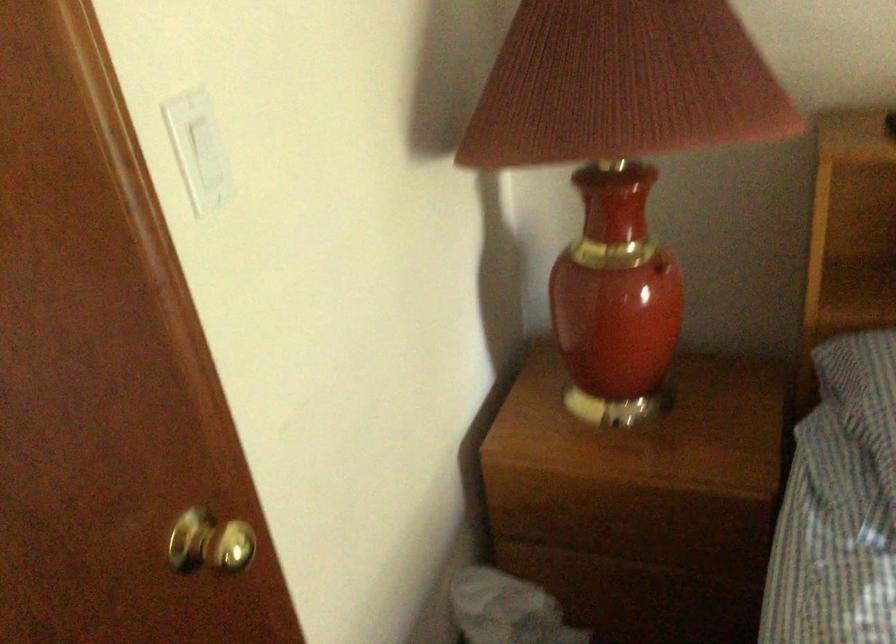
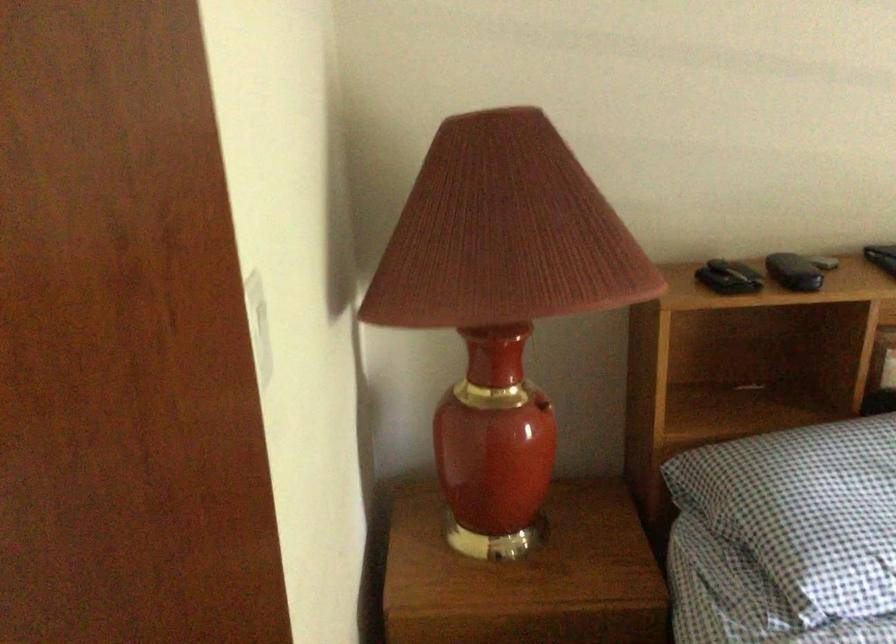
Question: In a continuous first-person perspective shot, in which direction is the camera moving?

Choices:
 (A) Left
 (B) Right
 (C) Forward
 (D) Backward

Answer: (A)